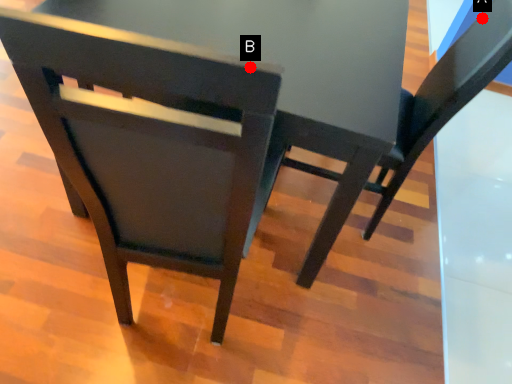
Question: Two points are circled on the image, labeled by A and B beside each circle. Which point is closer to the camera?

Choices:
 (A) A is closer
 (B) B is closer

Answer: (B)